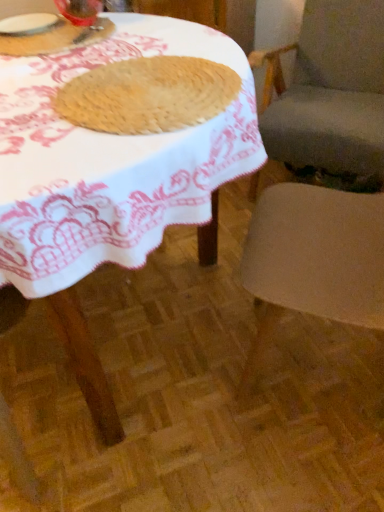
Find the location of a particular element. vacant region to the left of smooth beige chair at right, arranged as the 1th chair when viewed from the front is located at coordinates (186, 366).